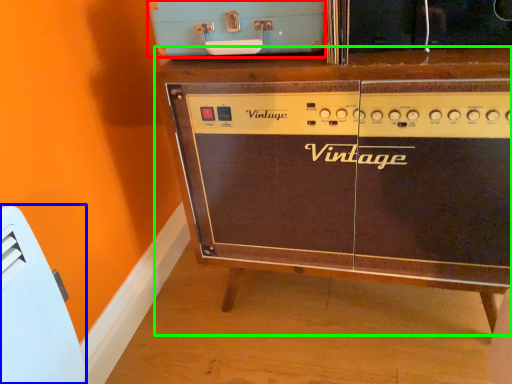
Question: Based on their relative distances, which object is nearer to appliance (highlighted by a red box)? Choose from appliance (highlighted by a blue box) and furniture (highlighted by a green box).

Choices:
 (A) appliance
 (B) furniture

Answer: (B)